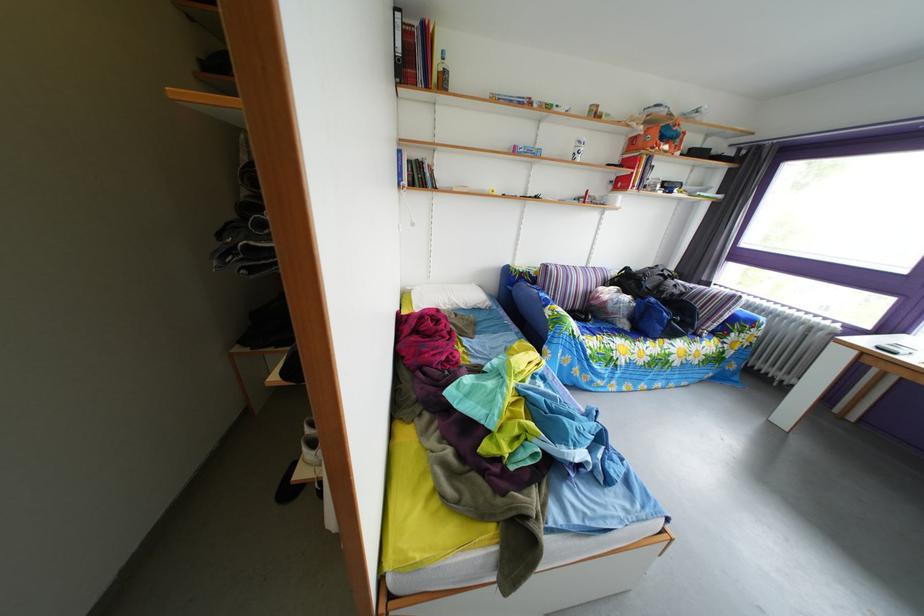
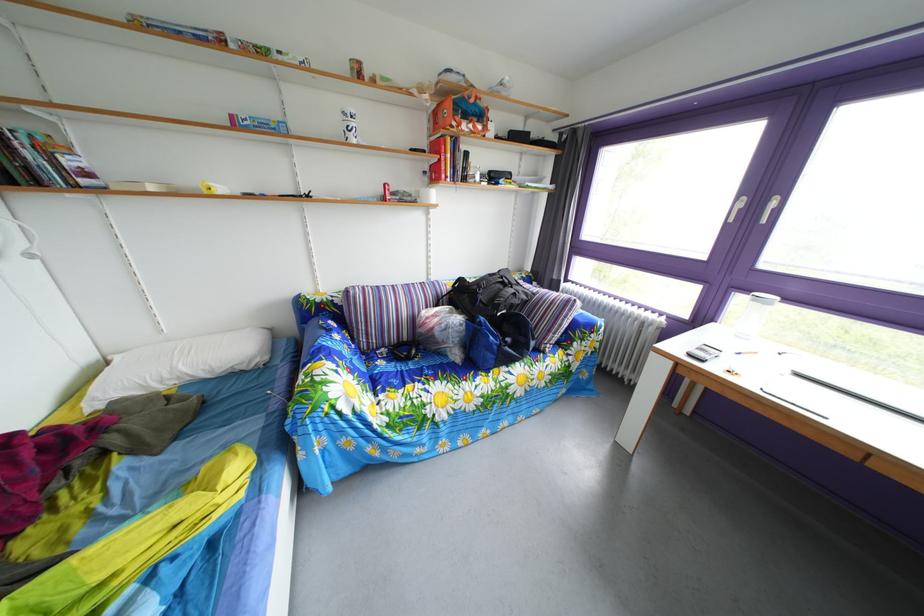
Looking at this image, in a continuous first-person perspective shot, in which direction is the camera moving?

The cameraman walked toward right, forward.